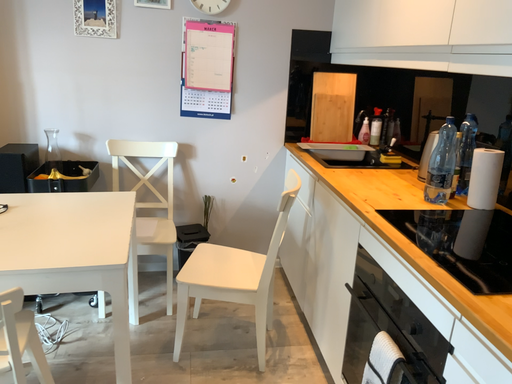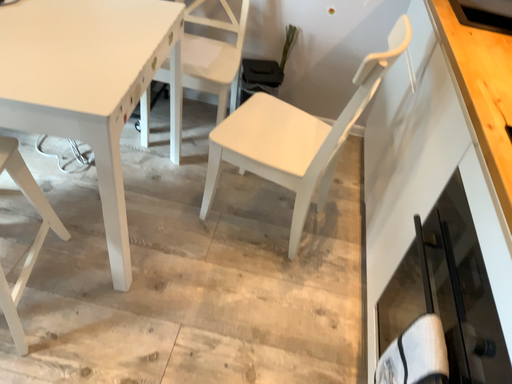
Question: Which way did the camera rotate in the video?

Choices:
 (A) rotated upward
 (B) rotated downward

Answer: (B)